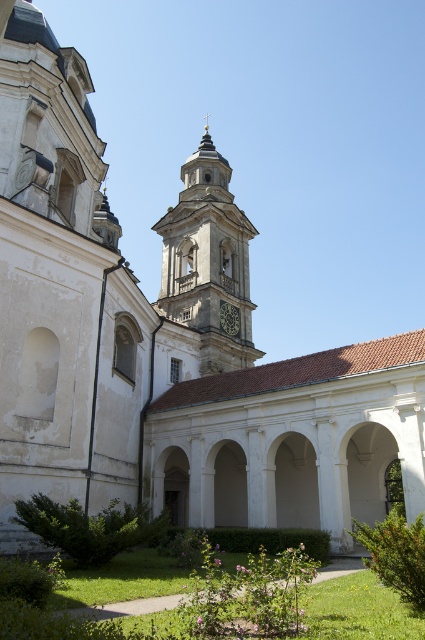
Question: Does smooth stone clock tower at center have a larger size compared to dark gray stone clock at center?

Choices:
 (A) yes
 (B) no

Answer: (A)

Question: Is smooth stone clock tower at center above dark gray stone clock at center?

Choices:
 (A) yes
 (B) no

Answer: (A)

Question: Does smooth stone clock tower at center come in front of dark gray stone clock at center?

Choices:
 (A) yes
 (B) no

Answer: (A)

Question: Which of the following is the farthest from the observer?

Choices:
 (A) dark gray stone clock at center
 (B) smooth stone clock tower at center

Answer: (A)

Question: Which point is closer to the camera?

Choices:
 (A) smooth stone clock tower at center
 (B) dark gray stone clock at center

Answer: (A)